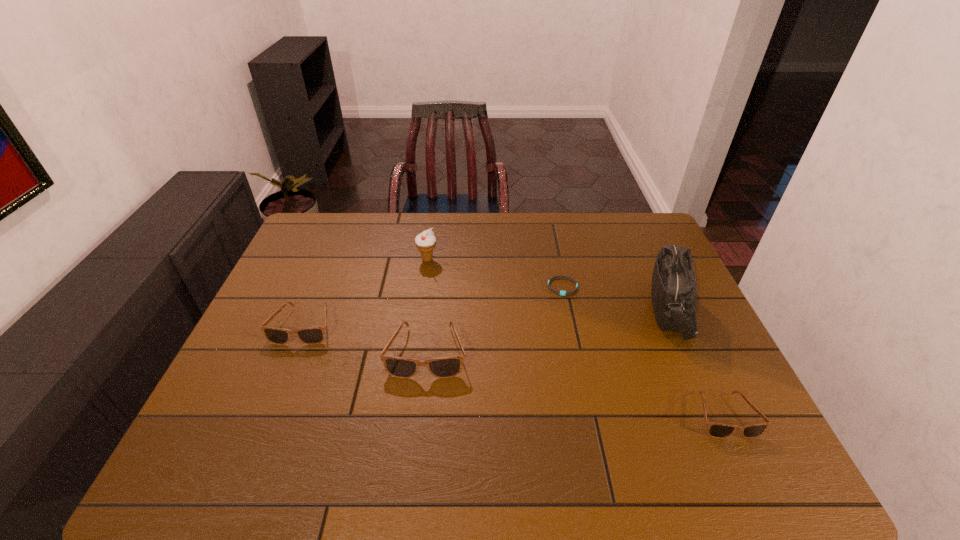
To achieve even spacing by inserting another sunglasses among them, please point to a vacant spot for this new sunglasses. Please provide its 2D coordinates. Your answer should be formatted as a tuple, i.e. [(x, y)], where the tuple contains the x and y coordinates of a point satisfying the conditions above.

[(566, 382)]